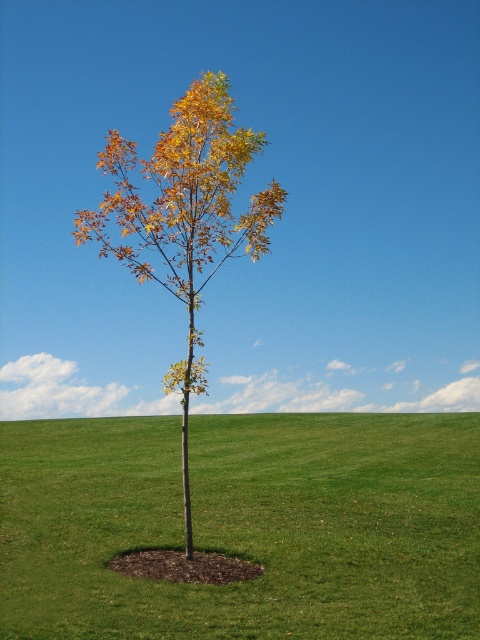
Can you confirm if green grass at center is smaller than yellow-green foliage at center?

No.

Who is lower down, green grass at center or yellow-green foliage at center?

Positioned lower is green grass at center.

This screenshot has height=640, width=480. What do you see at coordinates (243, 525) in the screenshot? I see `green grass at center` at bounding box center [243, 525].

This screenshot has width=480, height=640. Identify the location of green grass at center. (243, 525).